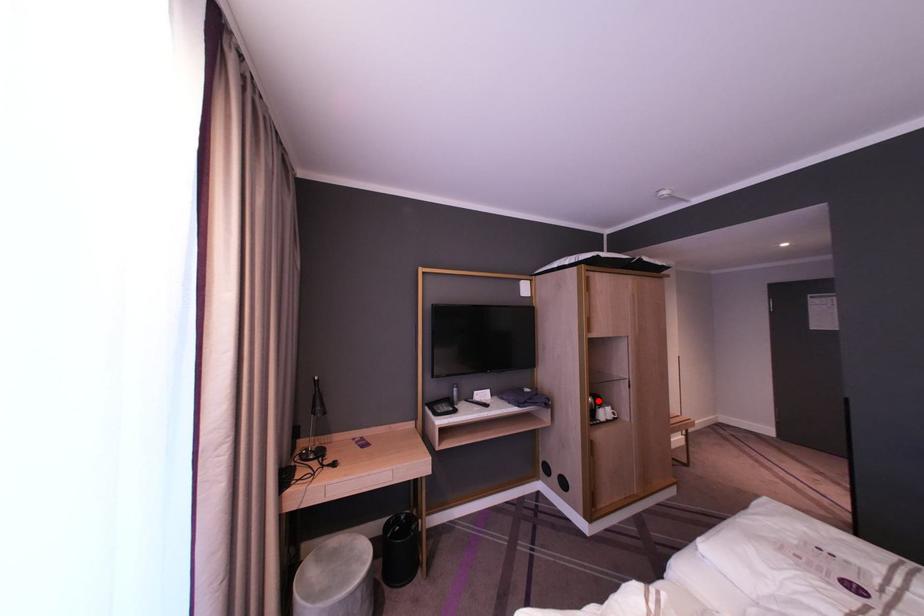
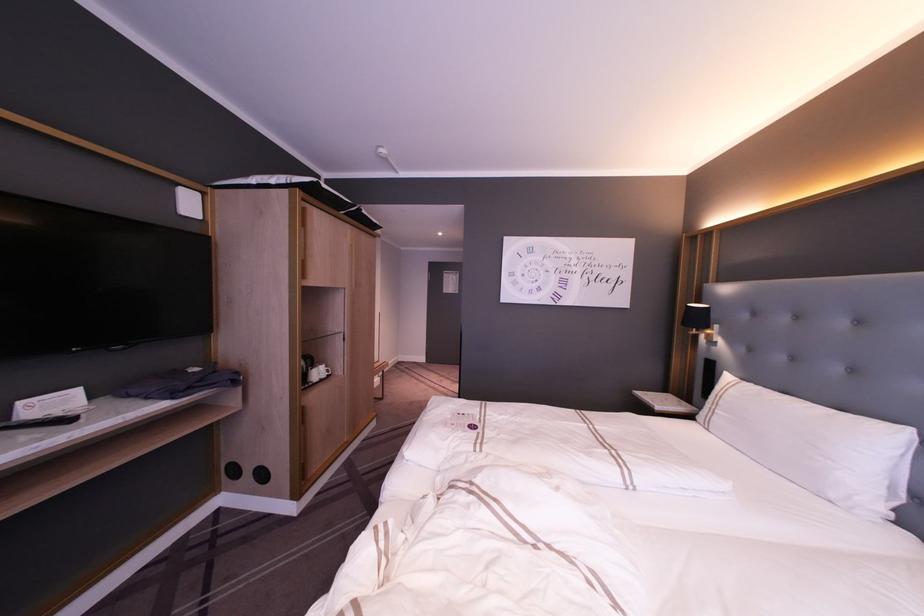
Locate, in the second image, the point that corresponds to the highlighted location in the first image.

(310, 362)